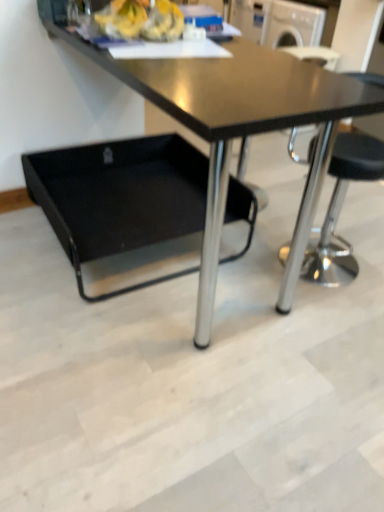
Question: Is black plastic swivel chair at lower left to the left of black glossy table at center from the viewer's perspective?

Choices:
 (A) yes
 (B) no

Answer: (A)

Question: Considering the relative sizes of black plastic swivel chair at lower left and black glossy table at center in the image provided, is black plastic swivel chair at lower left bigger than black glossy table at center?

Choices:
 (A) yes
 (B) no

Answer: (B)

Question: From a real-world perspective, is black plastic swivel chair at lower left over black glossy table at center?

Choices:
 (A) yes
 (B) no

Answer: (B)

Question: Is the position of black plastic swivel chair at lower left less distant than that of black glossy table at center?

Choices:
 (A) yes
 (B) no

Answer: (B)

Question: Is black plastic swivel chair at lower left aimed at black glossy table at center?

Choices:
 (A) yes
 (B) no

Answer: (A)

Question: Considering the relative sizes of black plastic swivel chair at lower left and black glossy table at center in the image provided, is black plastic swivel chair at lower left smaller than black glossy table at center?

Choices:
 (A) yes
 (B) no

Answer: (A)

Question: Can you confirm if black glossy table at center is bigger than black plastic swivel chair at lower left?

Choices:
 (A) no
 (B) yes

Answer: (B)

Question: Can you confirm if black glossy table at center is shorter than black plastic swivel chair at lower left?

Choices:
 (A) yes
 (B) no

Answer: (B)

Question: From the image's perspective, is black glossy table at center under black plastic swivel chair at lower left?

Choices:
 (A) no
 (B) yes

Answer: (A)

Question: Is black glossy table at center to the right of black plastic swivel chair at lower left from the viewer's perspective?

Choices:
 (A) no
 (B) yes

Answer: (B)

Question: Is black glossy table at center at the left side of black plastic swivel chair at lower left?

Choices:
 (A) yes
 (B) no

Answer: (B)

Question: Would you say black glossy table at center contains black plastic swivel chair at lower left?

Choices:
 (A) yes
 (B) no

Answer: (A)

Question: Is point (124, 224) positioned closer to the camera than point (286, 309)?

Choices:
 (A) farther
 (B) closer

Answer: (A)